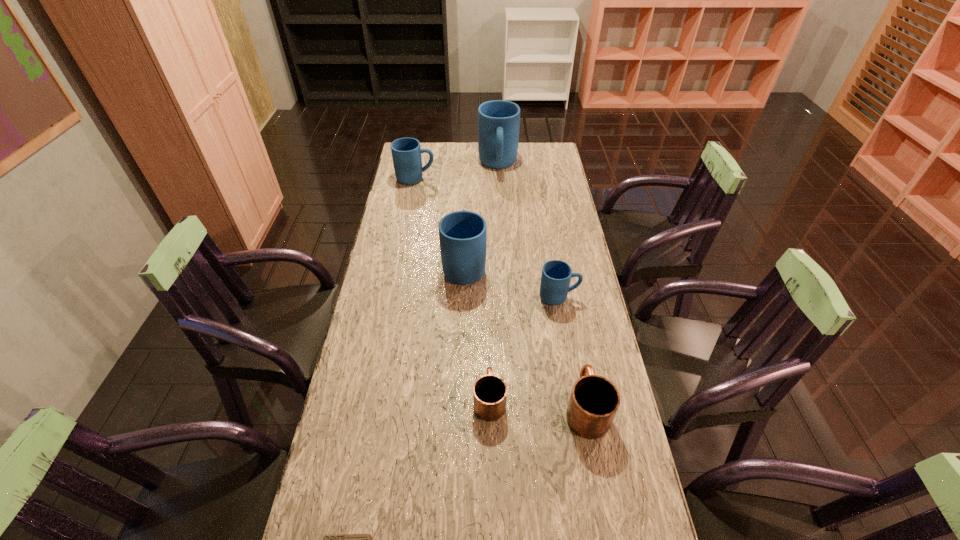
Locate an element on the screen. This screenshot has width=960, height=540. free location that satisfies the following two spatial constraints: 1. on the side of the third smallest blue mug with the handle; 2. on the side of the leftmost blue mug with the handle is located at coordinates (468, 179).

Find the location of a particular element. This screenshot has width=960, height=540. vacant region that satisfies the following two spatial constraints: 1. on the side of the biggest blue mug with the handle; 2. on the side of the fourth shortest mug with the handle is located at coordinates (498, 179).